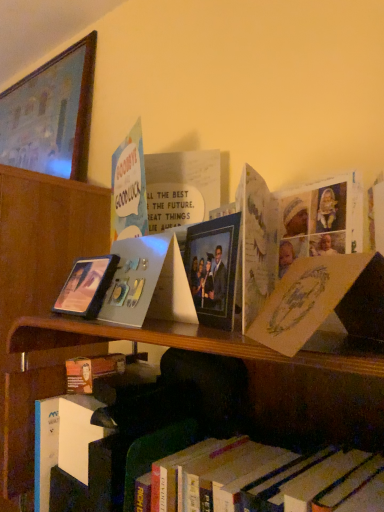
Question: Considering the positions of wooden picture frame at upper left, marked as the third picture frame in a front-to-back arrangement, and matte black picture frame at left, the second picture frame when ordered from left to right, in the image, is wooden picture frame at upper left, marked as the third picture frame in a front-to-back arrangement, bigger or smaller than matte black picture frame at left, the second picture frame when ordered from left to right,?

Choices:
 (A) small
 (B) big

Answer: (B)

Question: Is wooden picture frame at upper left, which is the 3th picture frame in bottom-to-top order, to the left or to the right of matte black picture frame at left, arranged as the 2th picture frame when viewed from the front, in the image?

Choices:
 (A) left
 (B) right

Answer: (A)

Question: Estimate the real-world distances between objects in this image. Which object is closer to the matte plastic picture frame at center, the second picture frame in the bottom-to-top sequence?

Choices:
 (A) yellow paper at upper right, placed as the 1th paperback book when sorted from front to back
 (B) wooden picture frame at upper left, marked as the 1th picture frame in a top-to-bottom arrangement
 (C) pastel paper card at upper left
 (D) matte black picture frame at left, the 3th picture frame positioned from the top
 (E) matte silver photo album at center, which ranks as the 2th paperback book in front-to-back order

Answer: (E)

Question: Estimate the real-world distances between objects in this image. Which object is farther from the matte plastic picture frame at center, the first picture frame in the right-to-left sequence?

Choices:
 (A) wooden picture frame at upper left, which appears as the 1th picture frame when viewed from the left
 (B) matte black picture frame at left, the second picture frame when ordered from left to right
 (C) yellow paper at upper right, the second paperback book in the back-to-front sequence
 (D) pastel paper card at upper left
 (E) matte silver photo album at center, which ranks as the 2th paperback book in front-to-back order

Answer: (A)